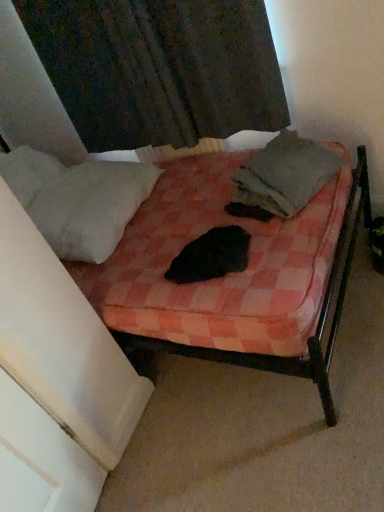
Question: From their relative heights in the image, would you say pink checkered fabric bed at center is taller or shorter than dark fabric curtain at upper center?

Choices:
 (A) short
 (B) tall

Answer: (B)

Question: Looking at their shapes, would you say pink checkered fabric bed at center is wider or thinner than dark fabric curtain at upper center?

Choices:
 (A) thin
 (B) wide

Answer: (B)

Question: Which object is the farthest from the white fluffy pillow at left?

Choices:
 (A) gray cotton blanket at center
 (B) pink checkered fabric bed at center
 (C) dark fabric curtain at upper center
 (D) black fur at center

Answer: (A)

Question: Estimate the real-world distances between objects in this image. Which object is farther from the dark fabric curtain at upper center?

Choices:
 (A) white fluffy pillow at left
 (B) black fur at center
 (C) pink checkered fabric bed at center
 (D) gray cotton blanket at center

Answer: (B)